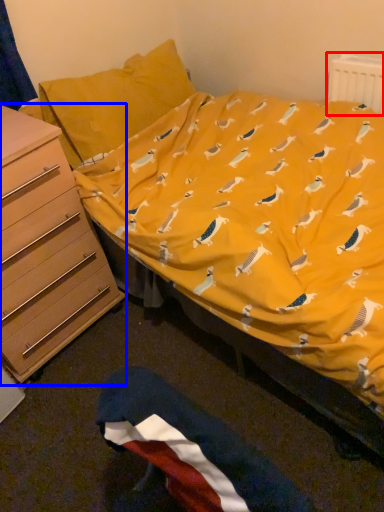
Question: Which object is closer to the camera taking this photo, radiator (highlighted by a red box) or chest of drawers (highlighted by a blue box)?

Choices:
 (A) radiator
 (B) chest of drawers

Answer: (B)